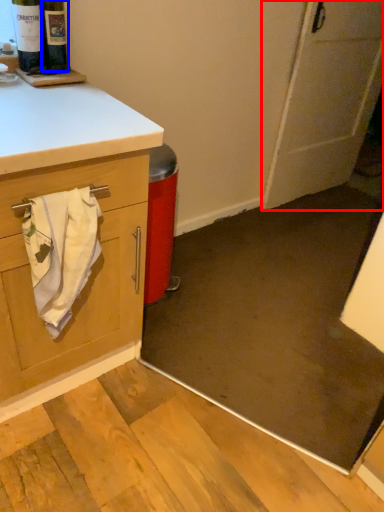
Question: Which object appears closest to the camera in this image, door (highlighted by a red box) or wine bottle (highlighted by a blue box)?

Choices:
 (A) door
 (B) wine bottle

Answer: (B)